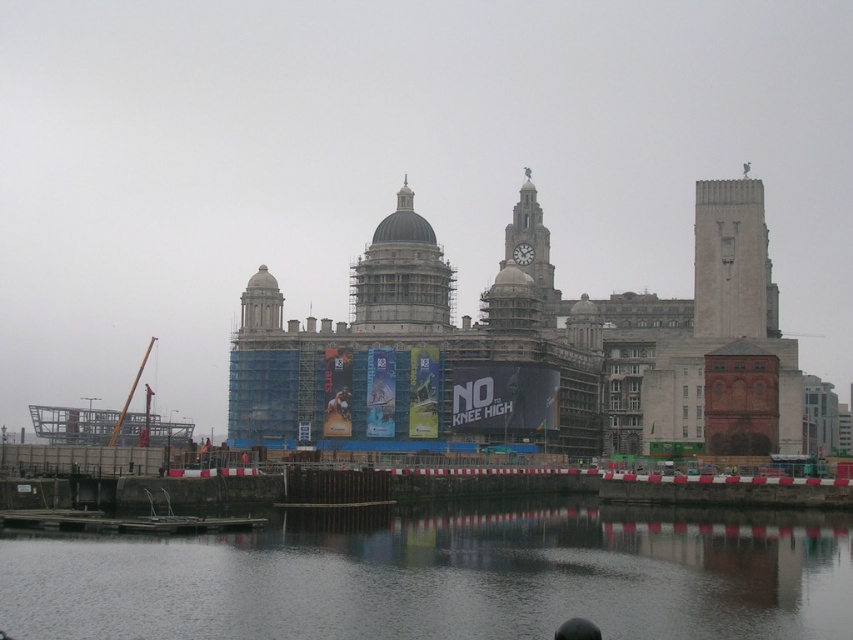
Question: Can you confirm if smooth dark water at lower center is positioned above gray stone dome at center?

Choices:
 (A) yes
 (B) no

Answer: (B)

Question: Which point is closer to the camera?

Choices:
 (A) (440, 316)
 (B) (231, 621)

Answer: (B)

Question: Which is farther from the smooth dark water at lower center?

Choices:
 (A) smooth concrete tower at upper right
 (B) gray stone dome at center

Answer: (A)

Question: Does smooth concrete tower at upper right have a greater width compared to gray stone dome at center?

Choices:
 (A) yes
 (B) no

Answer: (A)

Question: Which point appears farthest from the camera in this image?

Choices:
 (A) (769, 273)
 (B) (163, 540)
 (C) (405, 330)

Answer: (A)

Question: Where is smooth dark water at lower center located in relation to smooth concrete tower at upper right in the image?

Choices:
 (A) below
 (B) above

Answer: (A)